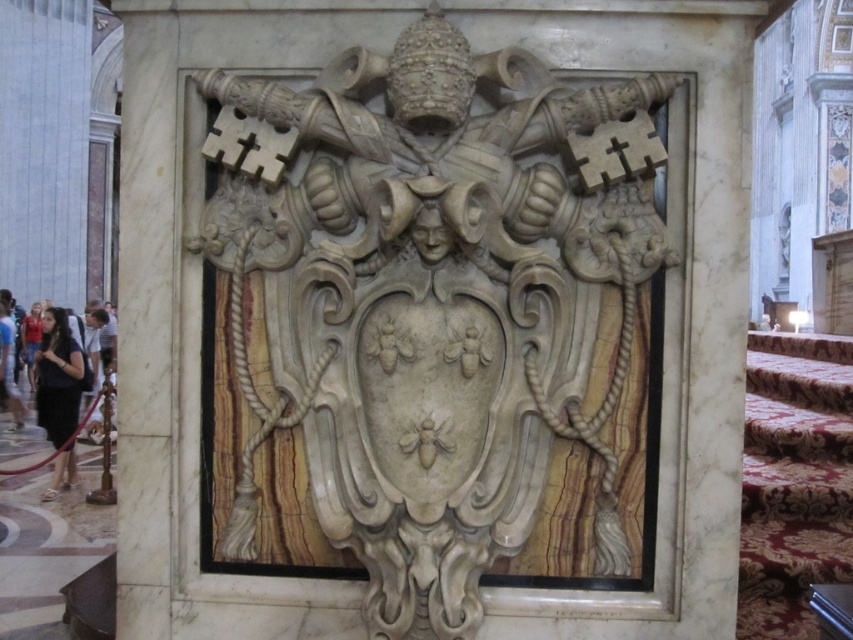
You are an art conservator standing at a distance. You need to clean the white marble sculpture at center. If your cleaning tool has a maximum reach of 8 feet, will you be able to reach the sculpture?

The white marble sculpture at center is 9.19 feet away from the viewer. Since the tool only reaches 8 feet, you cannot reach the sculpture.

You are an art conservator tasked with measuring the central white marble sculpture. Using a grid system where the bottom left corner of the image is coordinate point 0,0 and the top right corner is 1,1, what are the coordinates of the white marble sculpture at center?

The coordinates of the white marble sculpture at center are at point (433,324).

You are an art conservator examining the stone emblem. You notice two areas with dark brown hair at lower left and dark brown hair at left. Which of these two areas has a wider width?

The dark brown hair at lower left has a wider width than the dark brown hair at left.